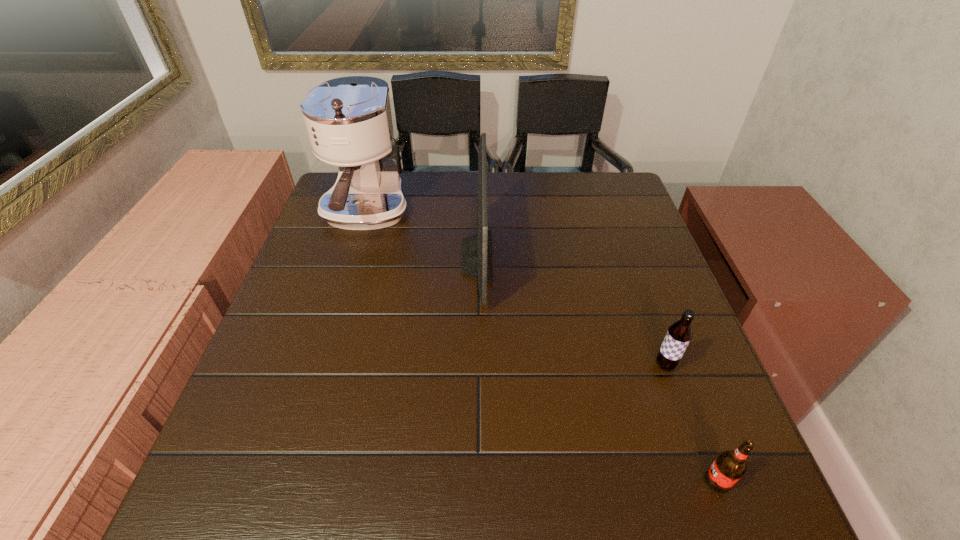
I want to click on the leftmost object, so click(x=348, y=120).

Where is `coffee maker`? The width and height of the screenshot is (960, 540). coffee maker is located at coordinates (348, 120).

You are a GUI agent. You are given a task and a screenshot of the screen. Output one action in this format:
    pyautogui.click(x=<x>, y=<y>)
    Task: Click on the second tallest object
    This screenshot has width=960, height=540.
    Given the screenshot: What is the action you would take?
    pyautogui.click(x=476, y=262)

Where is `the second object from left to right`? This screenshot has height=540, width=960. the second object from left to right is located at coordinates (476, 262).

Locate an element on the screen. the second nearest object is located at coordinates (679, 334).

This screenshot has width=960, height=540. In order to click on the farther root beer in this screenshot , I will do `click(679, 334)`.

Where is `the shorter root beer`? This screenshot has height=540, width=960. the shorter root beer is located at coordinates (729, 466).

This screenshot has height=540, width=960. I want to click on the nearest object, so click(729, 466).

Where is `free spot located on the front-facing side of the tallest object`? The image size is (960, 540). free spot located on the front-facing side of the tallest object is located at coordinates (331, 328).

Where is `free space located on the screen side of the monitor`? The height and width of the screenshot is (540, 960). free space located on the screen side of the monitor is located at coordinates (608, 257).